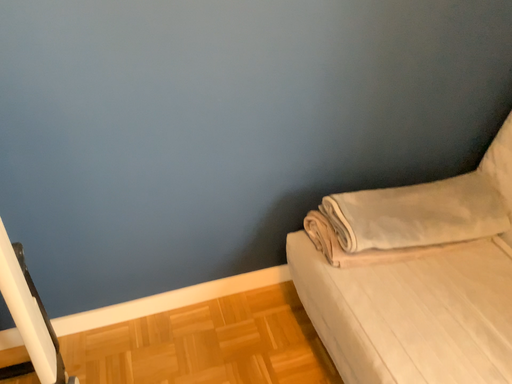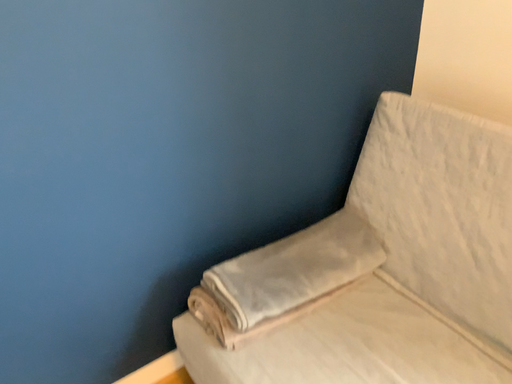
Question: How did the camera likely rotate when shooting the video?

Choices:
 (A) rotated right
 (B) rotated left

Answer: (A)